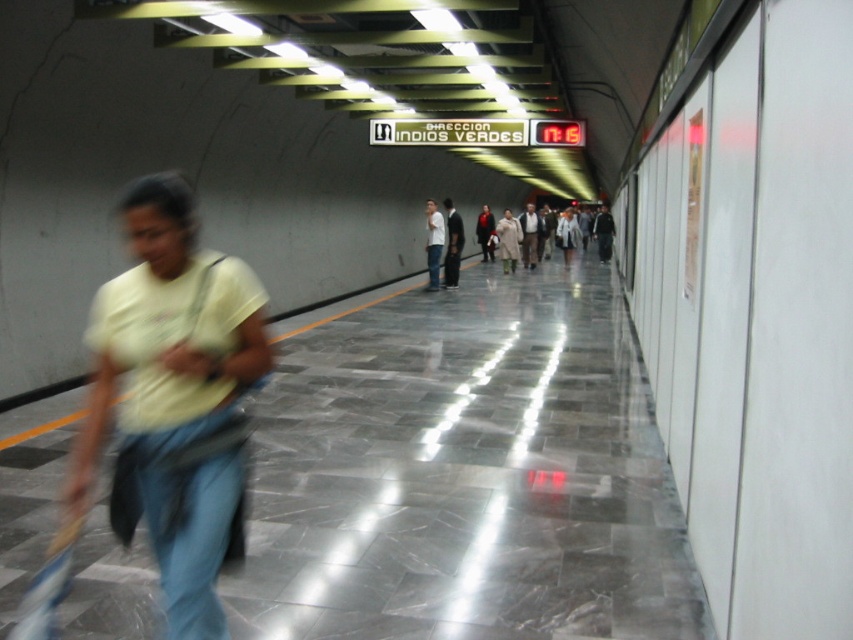
Question: Can you confirm if light beige coat at center is positioned to the left of light brown leather jacket at center?

Choices:
 (A) yes
 (B) no

Answer: (A)

Question: Is white matte shirt at center below light beige coat at center?

Choices:
 (A) no
 (B) yes

Answer: (B)

Question: Does white matte shirt at center have a lesser width compared to light beige coat at center?

Choices:
 (A) no
 (B) yes

Answer: (B)

Question: Which object appears closest to the camera in this image?

Choices:
 (A) blue denim jeans at left
 (B) white shirt at center
 (C) dark gray jacket at center

Answer: (A)

Question: Estimate the real-world distances between objects in this image. Which object is farther from the dark gray jacket at center?

Choices:
 (A) yellow matte shirt at left
 (B) blue denim jeans at center

Answer: (A)

Question: Which point is farther to the camera?

Choices:
 (A) blue denim jeans at center
 (B) white shirt at center
 (C) light beige coat at center
 (D) dark gray jacket at center

Answer: (D)